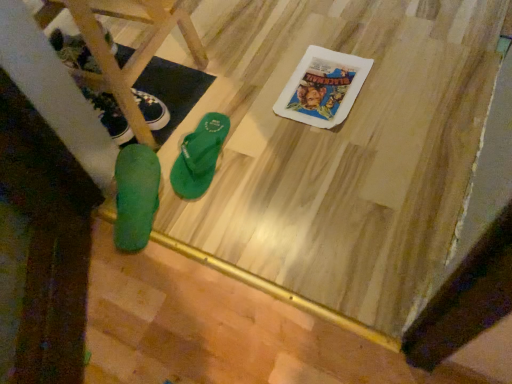
Question: Can you confirm if green rubber flip-flops at lower left is smaller than matte black sneaker at left, the 1th footwear when ordered from left to right?

Choices:
 (A) yes
 (B) no

Answer: (B)

Question: Does green rubber flip-flops at lower left turn towards matte black sneaker at left, marked as the third footwear in a right-to-left arrangement?

Choices:
 (A) yes
 (B) no

Answer: (B)

Question: From the image's perspective, is green rubber flip-flops at lower left on top of matte black sneaker at left, marked as the third footwear in a right-to-left arrangement?

Choices:
 (A) yes
 (B) no

Answer: (A)

Question: From a real-world perspective, is green rubber flip-flops at lower left positioned under matte black sneaker at left, marked as the third footwear in a right-to-left arrangement, based on gravity?

Choices:
 (A) no
 (B) yes

Answer: (A)

Question: Is green rubber flip-flops at lower left at the left side of matte black sneaker at left, marked as the third footwear in a right-to-left arrangement?

Choices:
 (A) no
 (B) yes

Answer: (B)

Question: Is green rubber flip-flop at lower left, which is the 2th footwear from left to right, bigger or smaller than matte black sneaker at left, the 1th footwear when ordered from left to right?

Choices:
 (A) small
 (B) big

Answer: (B)

Question: From a real-world perspective, relative to matte black sneaker at left, marked as the third footwear in a right-to-left arrangement, is green rubber flip-flop at lower left, which is the 2th footwear from left to right, vertically above or below?

Choices:
 (A) above
 (B) below

Answer: (A)

Question: Is green rubber flip-flop at lower left, which is the 2th footwear from left to right, wider or thinner than matte black sneaker at left, marked as the third footwear in a right-to-left arrangement?

Choices:
 (A) wide
 (B) thin

Answer: (A)

Question: In terms of height, does green rubber flip-flop at lower left, which is the 2th footwear from left to right, look taller or shorter compared to matte black sneaker at left, the 1th footwear when ordered from left to right?

Choices:
 (A) tall
 (B) short

Answer: (A)

Question: Is green rubber flip-flop at center, which appears as the 1th footwear when viewed from the right, to the left or to the right of matte black sneaker at left, marked as the third footwear in a right-to-left arrangement, in the image?

Choices:
 (A) right
 (B) left

Answer: (A)

Question: Considering the positions of green rubber flip-flop at center, which appears as the 1th footwear when viewed from the right, and matte black sneaker at left, marked as the third footwear in a right-to-left arrangement, in the image, is green rubber flip-flop at center, which appears as the 1th footwear when viewed from the right, taller or shorter than matte black sneaker at left, marked as the third footwear in a right-to-left arrangement,?

Choices:
 (A) short
 (B) tall

Answer: (A)

Question: Considering their positions, is green rubber flip-flop at center, the third footwear positioned from the left, located in front of or behind matte black sneaker at left, the 1th footwear when ordered from left to right?

Choices:
 (A) front
 (B) behind

Answer: (A)

Question: From a real-world perspective, is green rubber flip-flop at center, the third footwear positioned from the left, positioned above or below matte black sneaker at left, marked as the third footwear in a right-to-left arrangement?

Choices:
 (A) below
 (B) above

Answer: (A)

Question: Relative to green rubber flip-flop at lower left, which is the 2th footwear from left to right, is matte black sneaker at left, marked as the third footwear in a right-to-left arrangement, in front or behind?

Choices:
 (A) behind
 (B) front

Answer: (A)

Question: Is matte black sneaker at left, marked as the third footwear in a right-to-left arrangement, situated inside green rubber flip-flop at lower left, which is the 2th footwear from left to right, or outside?

Choices:
 (A) inside
 (B) outside

Answer: (B)